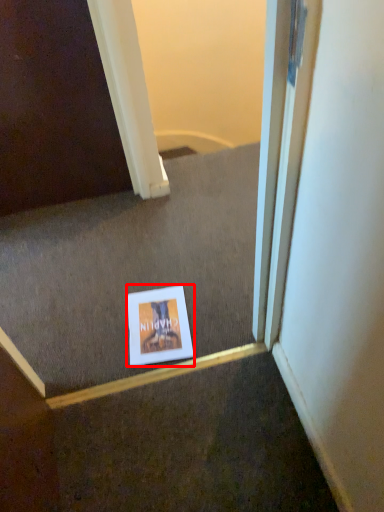
Question: Where is picture frame (annotated by the red box) located in relation to stairwell in the image?

Choices:
 (A) left
 (B) right

Answer: (B)